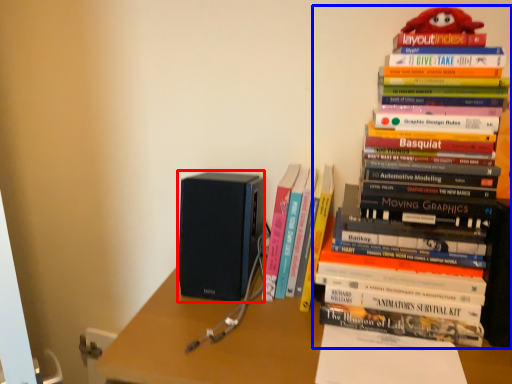
Question: Which point is closer to the camera, speaker (highlighted by a red box) or book (highlighted by a blue box)?

Choices:
 (A) speaker
 (B) book

Answer: (B)